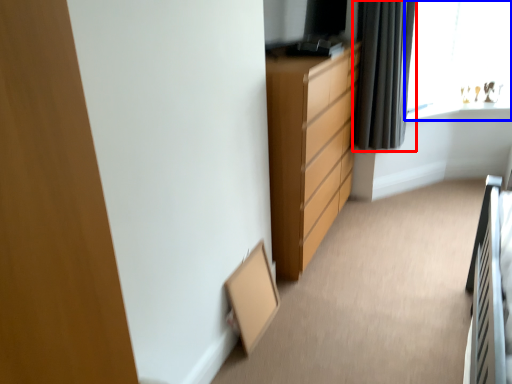
Question: Which object appears closest to the camera in this image, curtain (highlighted by a red box) or window (highlighted by a blue box)?

Choices:
 (A) curtain
 (B) window

Answer: (A)